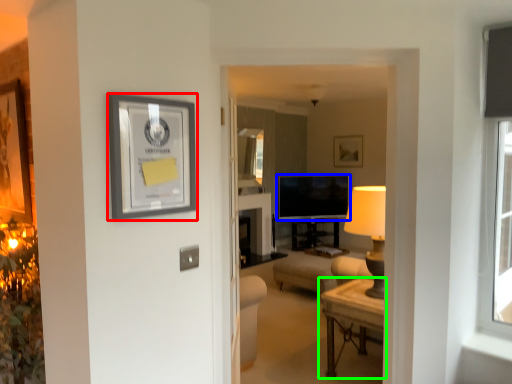
Question: Which is farther away from picture frame (highlighted by a red box)? television (highlighted by a blue box) or table (highlighted by a green box)?

Choices:
 (A) television
 (B) table

Answer: (A)